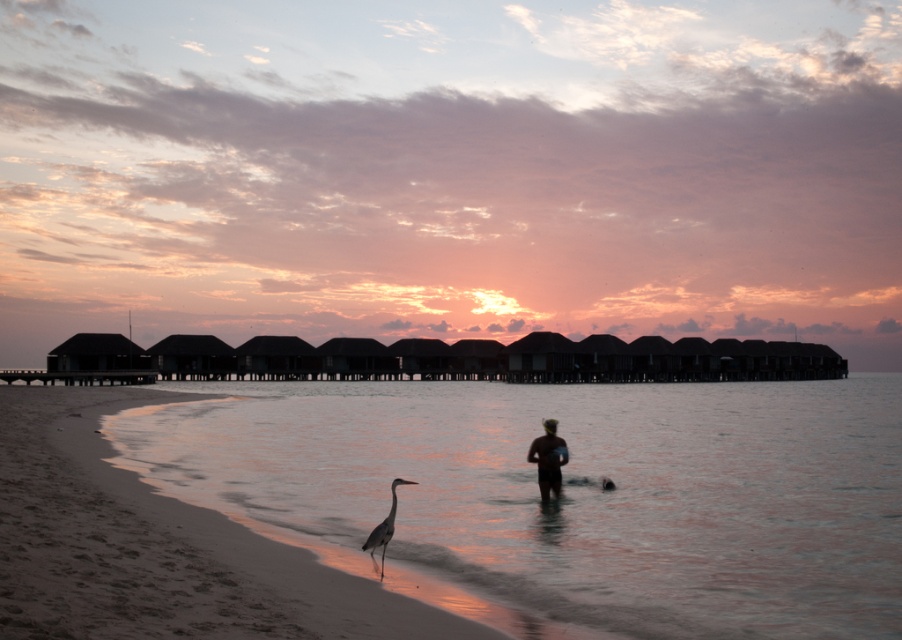
Is sandy water at lower left below sandy beach at lower left?

Yes, sandy water at lower left is below sandy beach at lower left.

Which of these two, sandy water at lower left or sandy beach at lower left, stands taller?

sandy water at lower left is taller.

This screenshot has width=902, height=640. I want to click on sandy water at lower left, so click(x=575, y=492).

Does black matte swimwear at center come behind gray matte bird at lower center?

Yes, black matte swimwear at center is behind gray matte bird at lower center.

Consider the image. Who is shorter, black matte swimwear at center or gray matte bird at lower center?

Standing shorter between the two is gray matte bird at lower center.

Is point (540, 444) farther from camera compared to point (371, 544)?

Yes, it is.

I want to click on black matte swimwear at center, so click(x=548, y=460).

Can you confirm if sandy beach at lower left is smaller than gray matte bird at lower center?

No, sandy beach at lower left is not smaller than gray matte bird at lower center.

Does sandy beach at lower left lie behind gray matte bird at lower center?

No, it is in front of gray matte bird at lower center.

Does point (466, 632) lie in front of point (398, 481)?

That is True.

This screenshot has height=640, width=902. In order to click on sandy beach at lower left in this screenshot , I will do `click(155, 547)`.